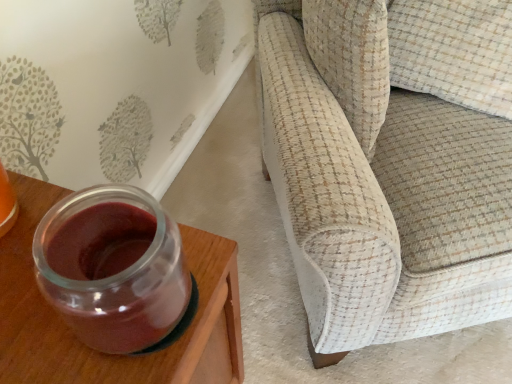
I want to click on textured beige fabric couch at right, so click(391, 162).

What do you see at coordinates (391, 162) in the screenshot?
I see `textured beige fabric couch at right` at bounding box center [391, 162].

In order to face textured beige fabric couch at right, should I rotate leftwards or rightwards?

Turn right approximately 22.310 degrees to face it.

Find the location of a particular element. This screenshot has width=512, height=384. transparent glass jar at left is located at coordinates (108, 354).

What do you see at coordinates (108, 354) in the screenshot?
I see `transparent glass jar at left` at bounding box center [108, 354].

Measure the distance between transparent glass jar at left and camera.

transparent glass jar at left is 31.12 centimeters away from camera.

You are a GUI agent. You are given a task and a screenshot of the screen. Output one action in this format:
    pyautogui.click(x=<x>, y=<y>)
    Task: Click on the textured beige fabric couch at right
    This screenshot has height=384, width=512.
    Given the screenshot: What is the action you would take?
    pyautogui.click(x=391, y=162)

Between transparent glass jar at left and textured beige fabric couch at right, which one appears on the left side from the viewer's perspective?

transparent glass jar at left.

Considering the relative positions of transparent glass jar at left and textured beige fabric couch at right in the image provided, is transparent glass jar at left in front of textured beige fabric couch at right?

Yes, the depth of transparent glass jar at left is less than that of textured beige fabric couch at right.

Which point is more forward, [213,332] or [436,61]?

The point [213,332] is closer.

From the image's perspective, which object appears higher, transparent glass jar at left or textured beige fabric couch at right?

textured beige fabric couch at right is shown above in the image.

From a real-world perspective, is transparent glass jar at left physically below textured beige fabric couch at right?

Incorrect, from a real-world perspective, transparent glass jar at left is higher than textured beige fabric couch at right.

Which object is thinner, transparent glass jar at left or textured beige fabric couch at right?

transparent glass jar at left is thinner.

Is transparent glass jar at left taller or shorter than textured beige fabric couch at right?

Clearly, transparent glass jar at left is shorter compared to textured beige fabric couch at right.

Considering the relative sizes of transparent glass jar at left and textured beige fabric couch at right in the image provided, is transparent glass jar at left bigger than textured beige fabric couch at right?

Incorrect, transparent glass jar at left is not larger than textured beige fabric couch at right.

Would you say transparent glass jar at left is outside textured beige fabric couch at right?

Yes, transparent glass jar at left is not within textured beige fabric couch at right.

In the scene shown: Would you say transparent glass jar at left is a long distance from textured beige fabric couch at right?

No.

Could you tell me if transparent glass jar at left is facing textured beige fabric couch at right?

No.

Measure the distance from transparent glass jar at left to textured beige fabric couch at right.

transparent glass jar at left and textured beige fabric couch at right are 16.94 inches apart from each other.

What are the coordinates of `studio couch above the transparent glass jar at left (from the image's perspective)` in the screenshot? It's located at (391, 162).

Considering the relative positions of textured beige fabric couch at right and transparent glass jar at left in the image provided, is textured beige fabric couch at right to the right of transparent glass jar at left from the viewer's perspective?

Yes, textured beige fabric couch at right is to the right of transparent glass jar at left.

Who is more distant, textured beige fabric couch at right or transparent glass jar at left?

textured beige fabric couch at right is further from the camera.

Is point (348, 23) farther from viewer compared to point (237, 370)?

Yes, point (348, 23) is farther from viewer.

From the image's perspective, is textured beige fabric couch at right located above or below transparent glass jar at left?

Clearly, from the image's perspective, textured beige fabric couch at right is above transparent glass jar at left.

From a real-world perspective, who is located lower, textured beige fabric couch at right or transparent glass jar at left?

From a 3D spatial view, textured beige fabric couch at right is below.

Is textured beige fabric couch at right thinner than transparent glass jar at left?

No, textured beige fabric couch at right is not thinner than transparent glass jar at left.

Considering the sizes of objects textured beige fabric couch at right and transparent glass jar at left in the image provided, who is shorter, textured beige fabric couch at right or transparent glass jar at left?

transparent glass jar at left is shorter.

Considering the sizes of objects textured beige fabric couch at right and transparent glass jar at left in the image provided, who is smaller, textured beige fabric couch at right or transparent glass jar at left?

transparent glass jar at left is smaller.

Is transparent glass jar at left a part of textured beige fabric couch at right?

No, transparent glass jar at left is located outside of textured beige fabric couch at right.

Is textured beige fabric couch at right placed right next to transparent glass jar at left?

No, textured beige fabric couch at right is not touching transparent glass jar at left.

Is textured beige fabric couch at right turned away from transparent glass jar at left?

That's not correct — textured beige fabric couch at right is not looking away from transparent glass jar at left.

How different are the orientations of textured beige fabric couch at right and transparent glass jar at left in degrees?

They differ by 60.2 degrees in their facing directions.

I want to click on furniture located on the left of textured beige fabric couch at right, so (x=108, y=354).

Find the location of a particular element. studio couch that appears on the right of transparent glass jar at left is located at coordinates (391, 162).

Locate an element on the screen. studio couch that is under the transparent glass jar at left (from a real-world perspective) is located at coordinates (391, 162).